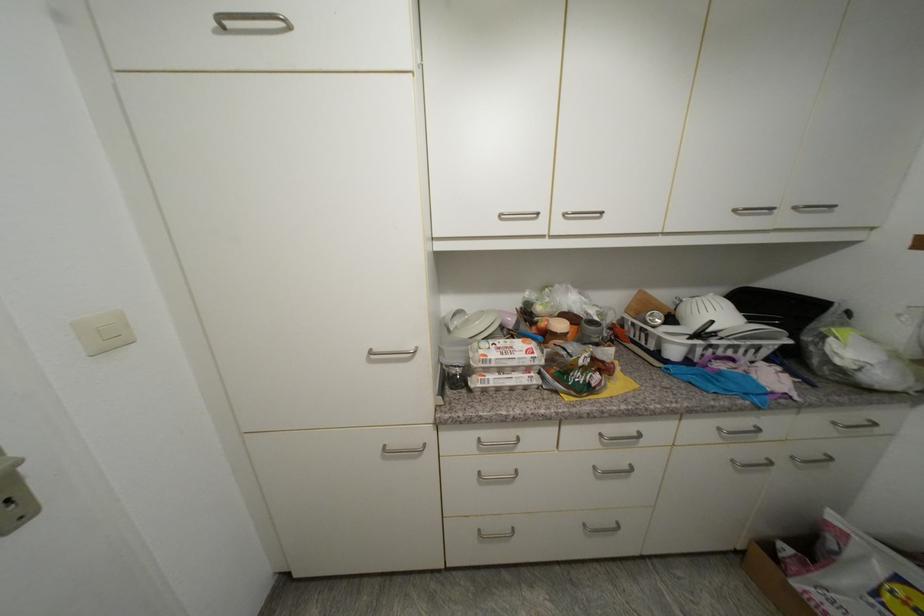
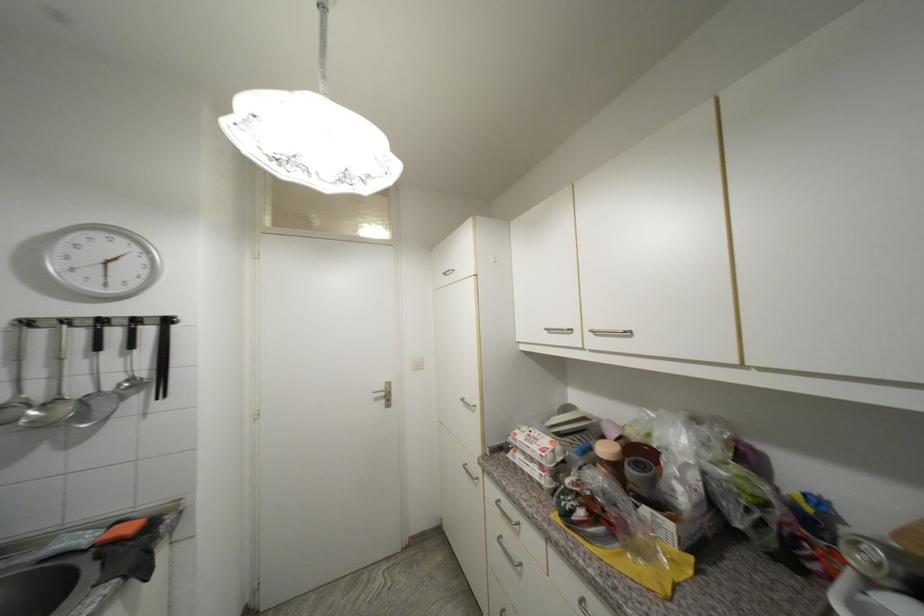
Find the pixel in the second image that matches (514,342) in the first image.

(548, 436)